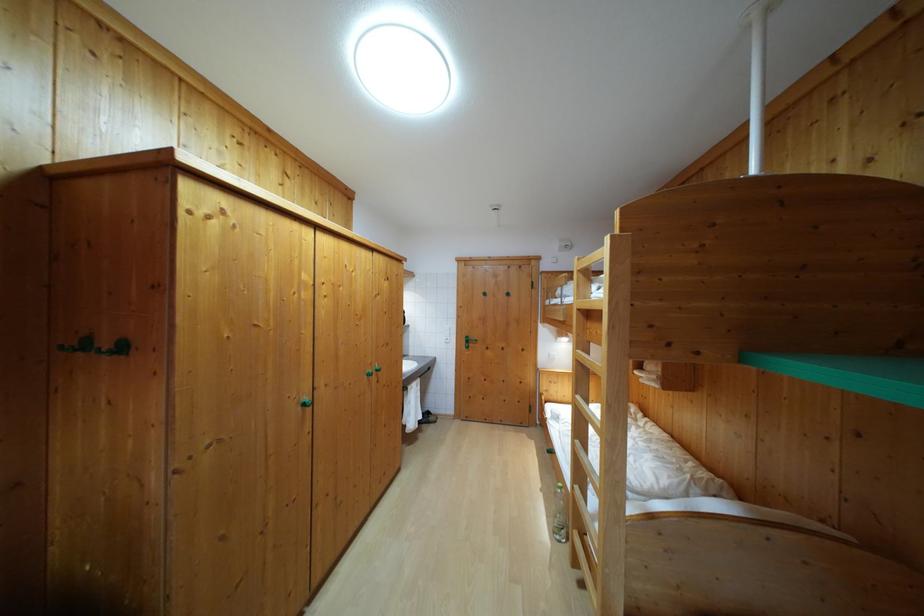
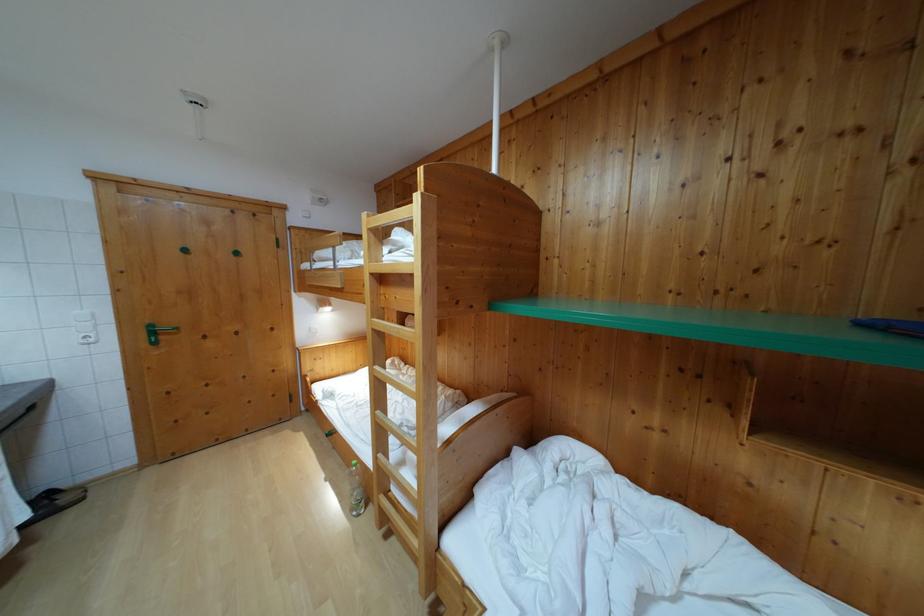
Locate, in the second image, the point that corresponds to point 423,424 in the first image.

(28, 524)